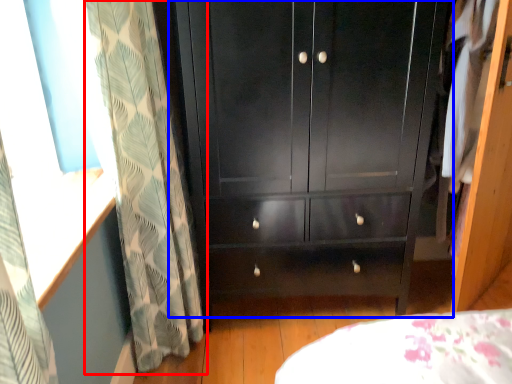
Question: Which object is further to the camera taking this photo, curtain (highlighted by a red box) or cupboard (highlighted by a blue box)?

Choices:
 (A) curtain
 (B) cupboard

Answer: (B)